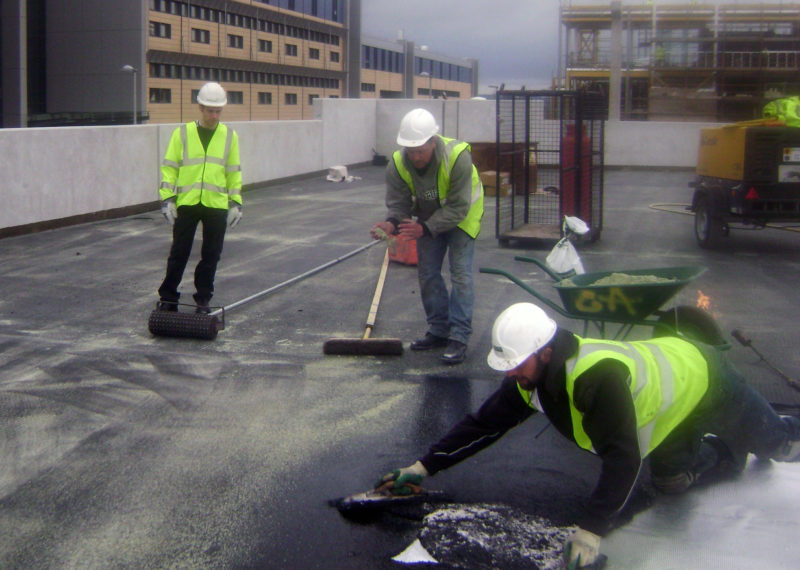
At what (x,y) coordinates should I click in order to perform the action: click on push broom on the floor. Please return your answer as a coordinate pair (x, y). Looking at the image, I should click on (366, 337).